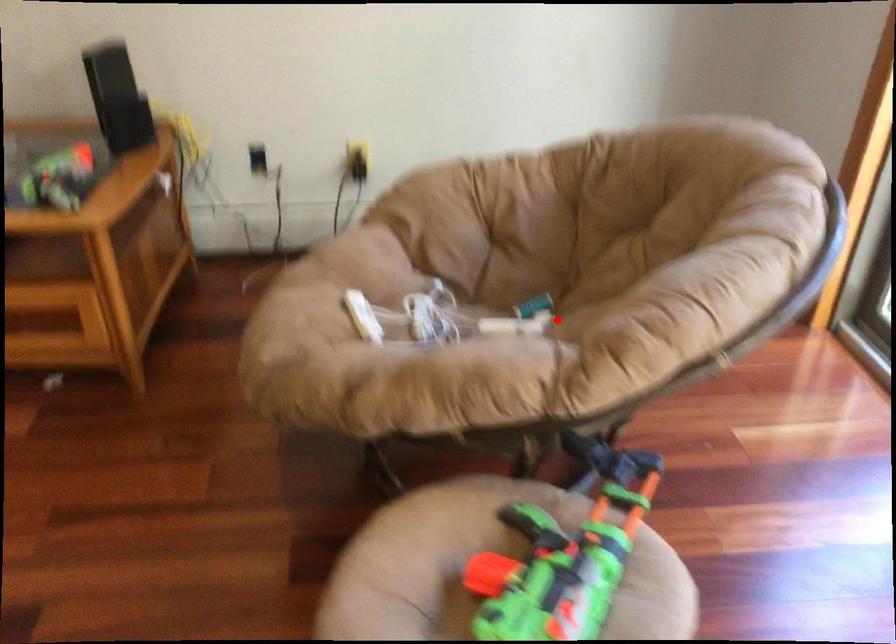
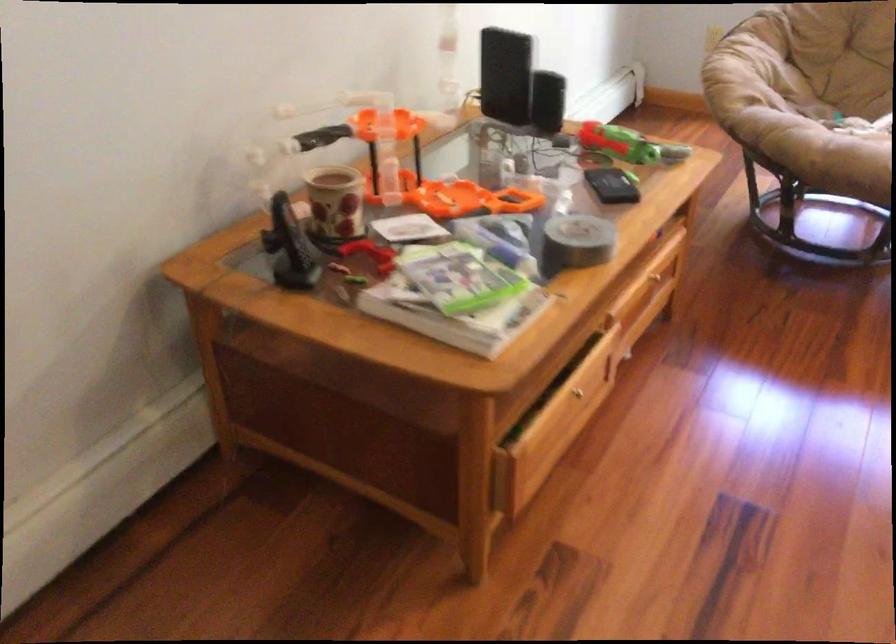
Find the pixel in the second image that matches the highlighted location in the first image.

(842, 118)